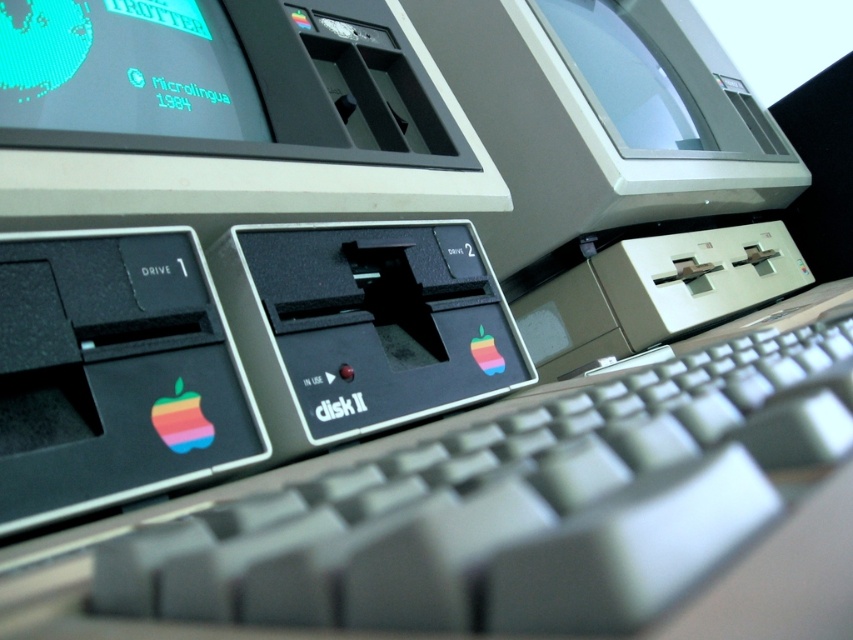
Who is more distant from viewer, (181, 48) or (611, 19)?

The point (611, 19) is more distant.

Is teal matte screen at upper left below transparent plastic monitor at upper center?

Yes.

The height and width of the screenshot is (640, 853). What do you see at coordinates (125, 68) in the screenshot?
I see `teal matte screen at upper left` at bounding box center [125, 68].

The width and height of the screenshot is (853, 640). I want to click on teal matte screen at upper left, so click(x=125, y=68).

In the scene shown: Does gray plastic keyboard at center have a greater height compared to transparent plastic monitor at upper center?

No, gray plastic keyboard at center is not taller than transparent plastic monitor at upper center.

Where is `gray plastic keyboard at center`? This screenshot has height=640, width=853. gray plastic keyboard at center is located at coordinates (509, 509).

The height and width of the screenshot is (640, 853). What do you see at coordinates (509, 509) in the screenshot?
I see `gray plastic keyboard at center` at bounding box center [509, 509].

The image size is (853, 640). Identify the location of gray plastic keyboard at center. (509, 509).

Which is below, gray plastic keyboard at center or teal matte screen at upper left?

gray plastic keyboard at center is lower down.

Measure the distance between gray plastic keyboard at center and teal matte screen at upper left.

gray plastic keyboard at center and teal matte screen at upper left are 24.70 inches apart from each other.

Is point (816, 456) positioned behind point (10, 68)?

No, (816, 456) is closer to viewer.

The width and height of the screenshot is (853, 640). I want to click on gray plastic keyboard at center, so click(x=509, y=509).